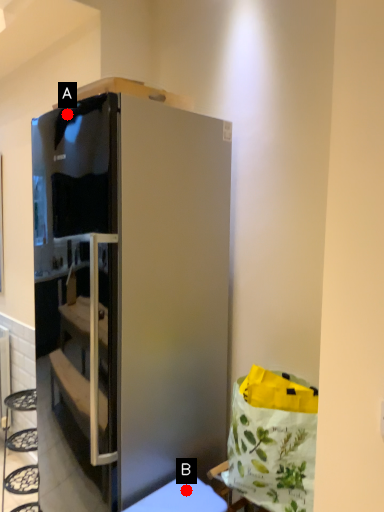
Question: Two points are circled on the image, labeled by A and B beside each circle. Among these points, which one is farthest from the camera?

Choices:
 (A) A is further
 (B) B is further

Answer: (A)